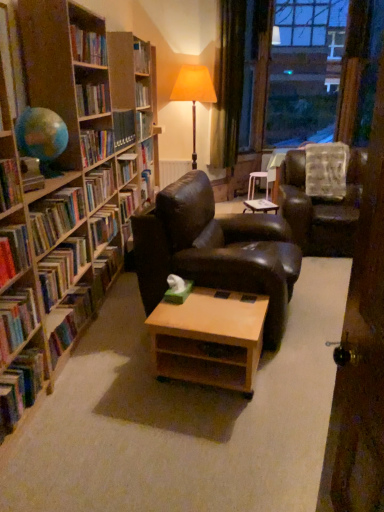
Where is `vacant region above light brown wood coffee table at center (from a real-world perspective)`? The height and width of the screenshot is (512, 384). vacant region above light brown wood coffee table at center (from a real-world perspective) is located at coordinates (210, 310).